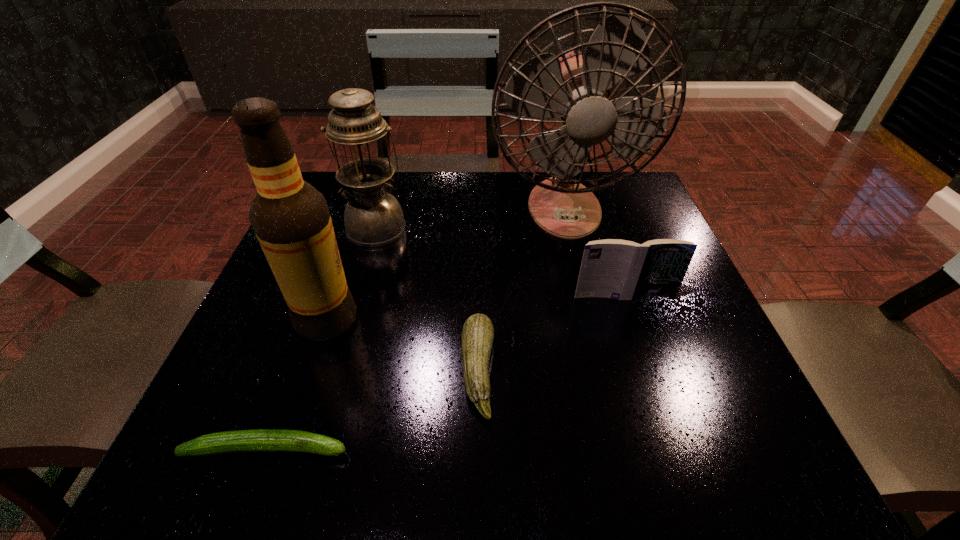
The width and height of the screenshot is (960, 540). I want to click on fan, so click(x=577, y=89).

Identify the location of alcohol. This screenshot has height=540, width=960. [291, 220].

The width and height of the screenshot is (960, 540). Find the location of `the fourth shortest object`. the fourth shortest object is located at coordinates (373, 217).

Find the location of a particular element. Image resolution: width=960 pixels, height=540 pixels. the third shortest object is located at coordinates (612, 268).

This screenshot has height=540, width=960. Identify the location of the farther zucchini. (477, 336).

Where is `the right zucchini`? Image resolution: width=960 pixels, height=540 pixels. the right zucchini is located at coordinates (x=477, y=336).

At what (x,y) coordinates should I click in order to perform the action: click on the left zucchini. Please return your answer as a coordinate pair (x, y). Image resolution: width=960 pixels, height=540 pixels. Looking at the image, I should click on (260, 440).

What are the coordinates of `the nearest object` in the screenshot? It's located at (260, 440).

Where is `vacant space located 0.310m in front of the fan to direct airflow`? vacant space located 0.310m in front of the fan to direct airflow is located at coordinates (600, 358).

Locate an element on the screen. free space located 0.340m on the label of the alcohol is located at coordinates (543, 320).